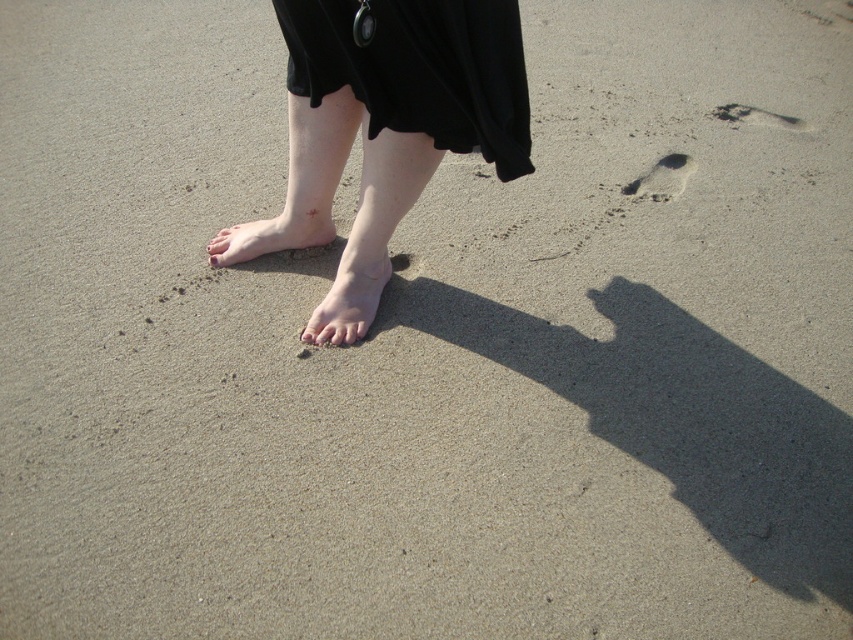
Between pale skin at center and brown sandy footprint at lower right, which one has more height?

Standing taller between the two is brown sandy footprint at lower right.

Does pale skin at center have a lesser height compared to brown sandy footprint at lower right?

Correct, pale skin at center is not as tall as brown sandy footprint at lower right.

You are a GUI agent. You are given a task and a screenshot of the screen. Output one action in this format:
    pyautogui.click(x=<x>, y=<y>)
    Task: Click on the pale skin at center
    The image size is (853, 640).
    Given the screenshot: What is the action you would take?
    pyautogui.click(x=273, y=234)

Is black matte skirt at center to the right of pink flesh at center from the viewer's perspective?

Correct, you'll find black matte skirt at center to the right of pink flesh at center.

Is black matte skirt at center shorter than pink flesh at center?

No, black matte skirt at center is not shorter than pink flesh at center.

Find the location of a particular element. Image resolution: width=853 pixels, height=640 pixels. black matte skirt at center is located at coordinates (419, 68).

Can you confirm if smooth skin foot at center is positioned below brown sandy footprint at upper right?

Indeed, smooth skin foot at center is positioned under brown sandy footprint at upper right.

Is point (381, 262) closer to camera compared to point (801, 131)?

Yes, it is.

Who is more distant from viewer, (390, 145) or (767, 120)?

Point (767, 120)

At what (x,y) coordinates should I click in order to perform the action: click on smooth skin foot at center. Please return your answer as a coordinate pair (x, y). Image resolution: width=853 pixels, height=640 pixels. Looking at the image, I should click on (351, 294).